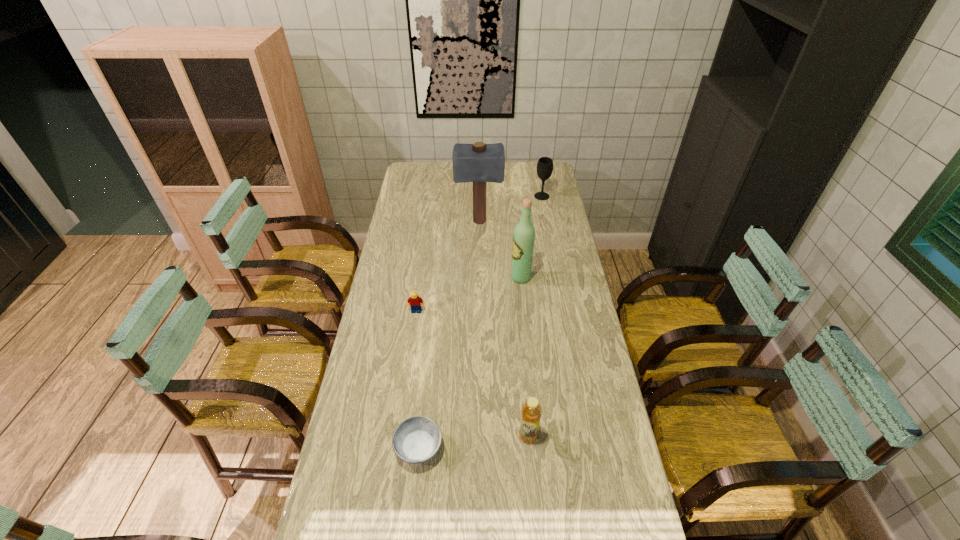
At what (x,y) coordinates should I click in order to perform the action: click on the second farthest object. Please return your answer as a coordinate pair (x, y). The image size is (960, 540). Looking at the image, I should click on (479, 163).

Identify the location of wine bottle. (524, 234).

What are the coordinates of `the rightmost object` in the screenshot? It's located at (545, 164).

The height and width of the screenshot is (540, 960). Identify the location of wineglass. (545, 164).

This screenshot has height=540, width=960. What are the coordinates of `bottle` in the screenshot? It's located at (531, 412).

Identify the location of Lego. The width and height of the screenshot is (960, 540). (416, 302).

Locate an element on the screen. This screenshot has height=540, width=960. the second shortest object is located at coordinates (416, 302).

Image resolution: width=960 pixels, height=540 pixels. Find the location of `the shortest object`. the shortest object is located at coordinates pos(415,440).

Identify the location of vacant area situated on the front of the second farthest object. The width and height of the screenshot is (960, 540). (479, 256).

Identify the location of free space located 0.330m on the front-facing side of the wine bottle. Image resolution: width=960 pixels, height=540 pixels. (429, 278).